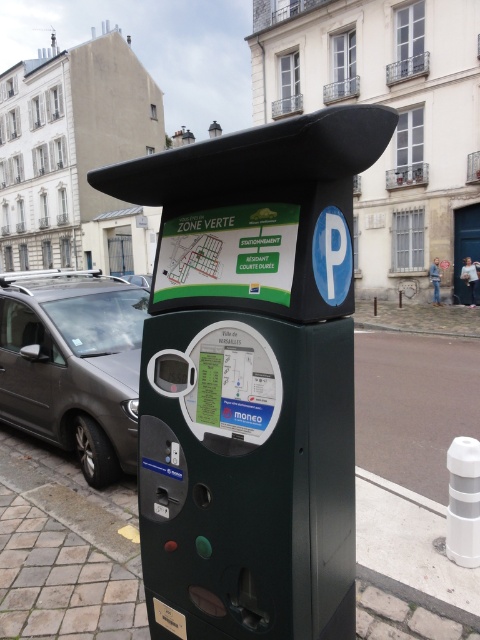
What is the spatial relationship between the green plastic parking meter at center and the dark gray metallic van at left in the scene?

The green plastic parking meter at center is in front of the dark gray metallic van at left.

You are a delivery driver who needs to park your dark gray metallic van at left near the green plastic parking meter at center. Since the parking meter requires payment, you want to know if your van can fit between the meter and the curb. Can you determine if the van will fit based on their widths?

The green plastic parking meter at center is narrower than the dark gray metallic van at left, so the van may not fit between the meter and the curb if the available space is only as wide as the meter. However, without knowing the exact width of the curb space, it is difficult to confirm. Please check the actual space dimensions before parking.